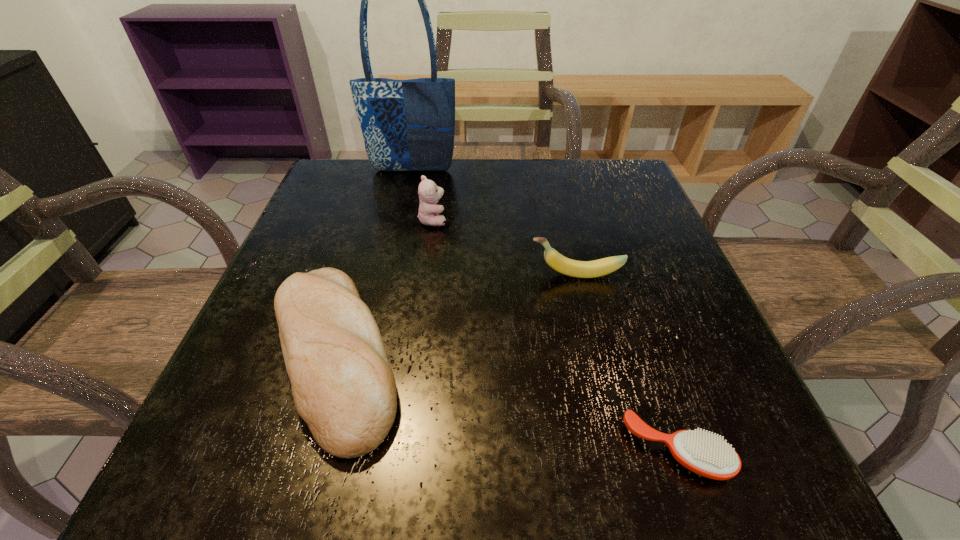
Identify the location of vacant region between the tallest object and the banana. The image size is (960, 540). (494, 222).

Locate an element on the screen. This screenshot has height=540, width=960. object that ranks as the closest to the shopping bag is located at coordinates (429, 193).

Locate which object ranks third in proximity to the hairbrush. Please provide its 2D coordinates. Your answer should be formatted as a tuple, i.e. [(x, y)], where the tuple contains the x and y coordinates of a point satisfying the conditions above.

[(429, 193)]

The width and height of the screenshot is (960, 540). I want to click on free location that satisfies the following two spatial constraints: 1. at the face of the hairbrush; 2. on the right side of the teddy bear, so click(402, 450).

At what (x,y) coordinates should I click in order to perform the action: click on vacant point that satisfies the following two spatial constraints: 1. at the face of the teddy bear; 2. on the front side of the bread. Please return your answer as a coordinate pair (x, y). The image size is (960, 540). Looking at the image, I should click on (415, 355).

At what (x,y) coordinates should I click in order to perform the action: click on blank area in the image that satisfies the following two spatial constraints: 1. at the face of the teddy bear; 2. on the left side of the hairbrush. Please return your answer as a coordinate pair (x, y). Image resolution: width=960 pixels, height=540 pixels. Looking at the image, I should click on (402, 450).